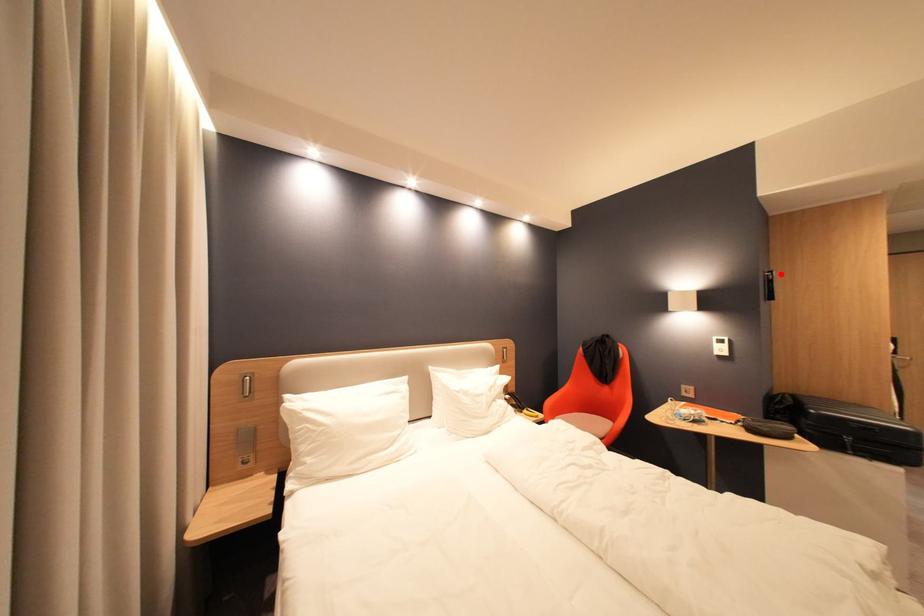
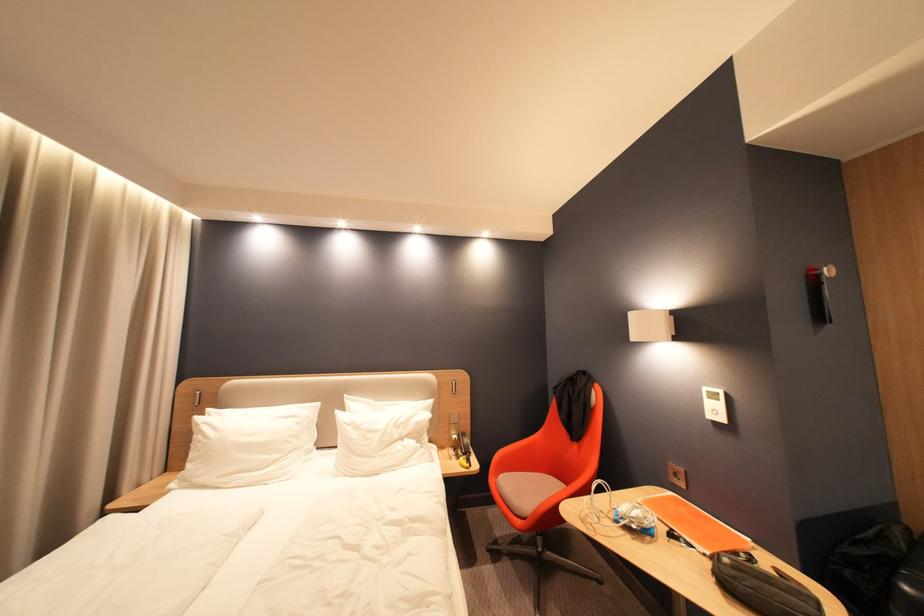
The point at the highlighted location is marked in the first image. Where is the corresponding point in the second image?

(830, 270)